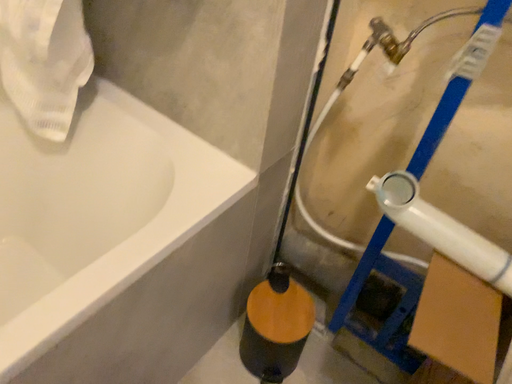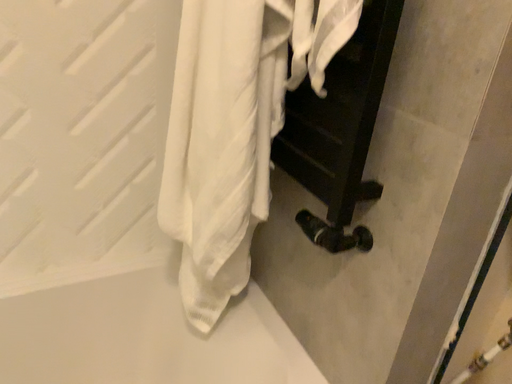
Question: Which way did the camera rotate in the video?

Choices:
 (A) rotated left
 (B) rotated right

Answer: (A)